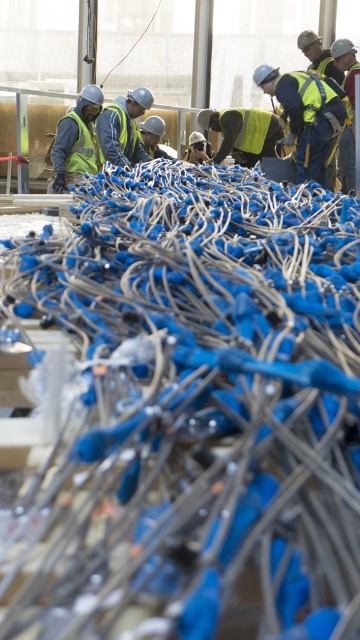
Which is above, matte black safety vest at left or yellow reflective safety vest at center?

yellow reflective safety vest at center is higher up.

Where is `matte black safety vest at left`? The image size is (360, 640). matte black safety vest at left is located at coordinates (77, 138).

Can you confirm if reflective yellow vest at upper right is bigger than reflective yellow safety vest at center?

Correct, reflective yellow vest at upper right is larger in size than reflective yellow safety vest at center.

From the picture: Could you measure the distance between reflective yellow vest at upper right and reflective yellow safety vest at center?

reflective yellow vest at upper right and reflective yellow safety vest at center are 1.78 meters apart.

The height and width of the screenshot is (640, 360). Describe the element at coordinates (307, 115) in the screenshot. I see `reflective yellow vest at upper right` at that location.

This screenshot has height=640, width=360. Identify the location of reflective yellow vest at upper right. (307, 115).

Is reflective yellow vest at upper right above yellow reflective vest at center?

Yes.

Is reflective yellow vest at upper right bigger than yellow reflective vest at center?

Yes.

What do you see at coordinates (307, 115) in the screenshot? The image size is (360, 640). I see `reflective yellow vest at upper right` at bounding box center [307, 115].

Locate an element on the screen. reflective yellow vest at upper right is located at coordinates (307, 115).